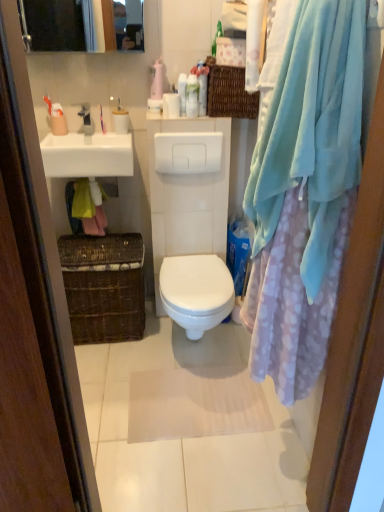
Locate an element on the screen. empty space that is ontop of brown woven laundry basket at lower left is located at coordinates pyautogui.click(x=107, y=244).